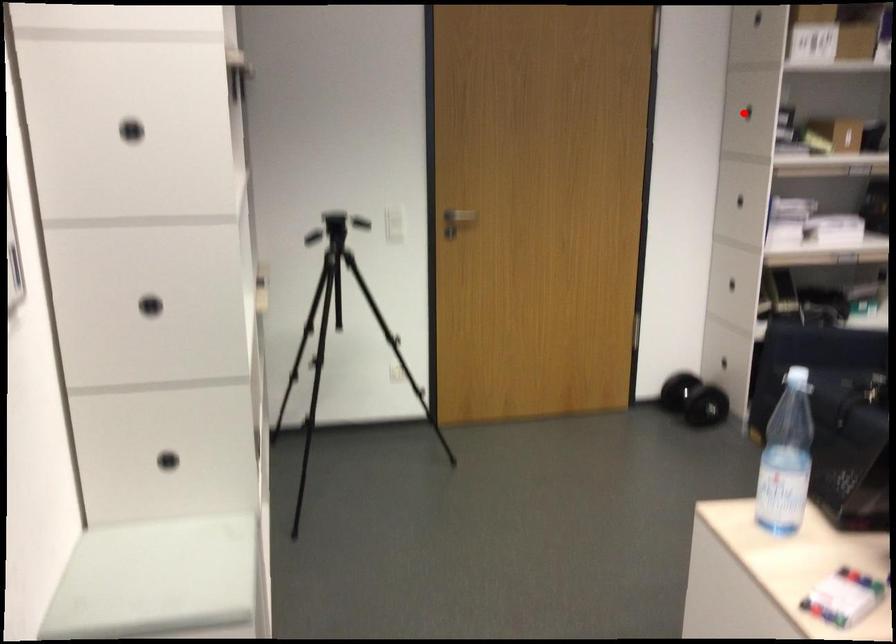
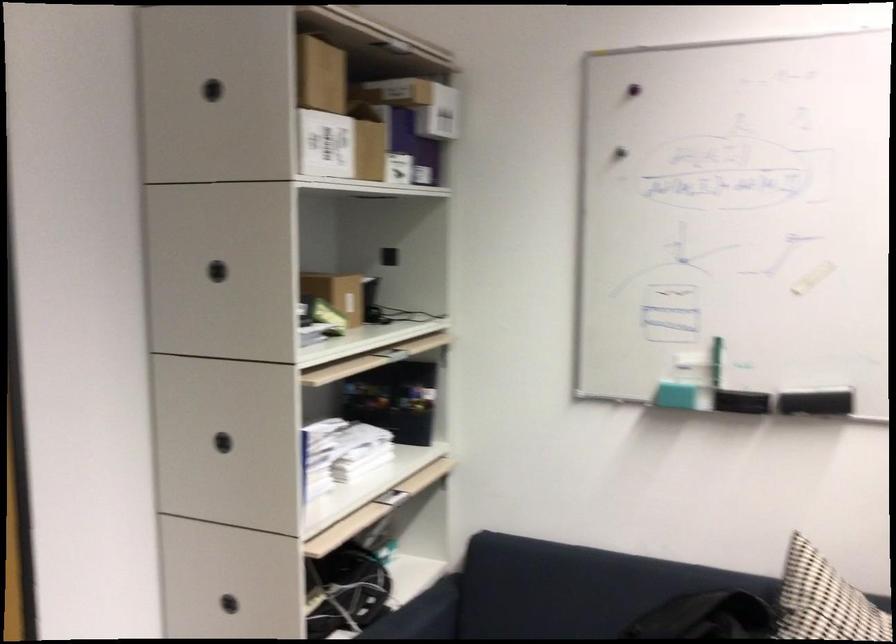
In the second image, find the point that corresponds to the highlighted location in the first image.

(217, 270)